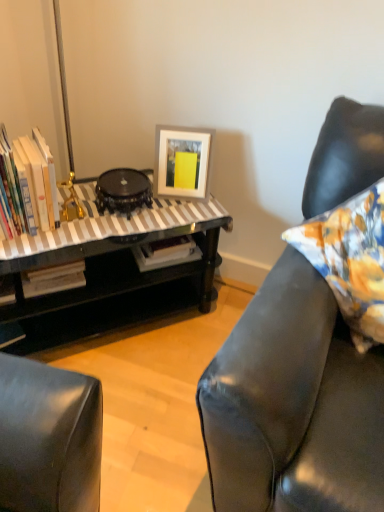
Find the location of `free region on the left part of black glossy round table at center`. free region on the left part of black glossy round table at center is located at coordinates (73, 207).